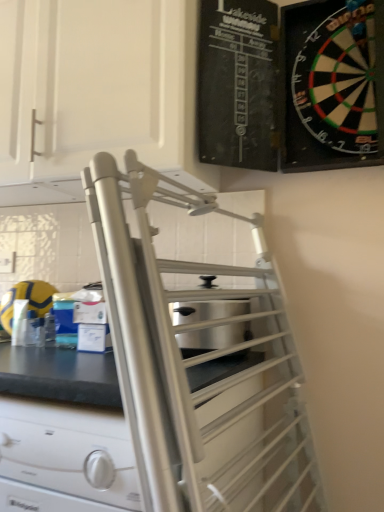
Describe the element at coordinates (96, 92) in the screenshot. I see `white matte cabinet at upper left, which is the 2th cabinetry from right to left` at that location.

The width and height of the screenshot is (384, 512). Describe the element at coordinates (332, 84) in the screenshot. I see `black plastic dartboard at upper right, the first cabinetry positioned from the right` at that location.

Describe the element at coordinates (213, 338) in the screenshot. I see `stainless steel toaster at center` at that location.

The width and height of the screenshot is (384, 512). I want to click on white matte cabinet at upper left, which is the 2th cabinetry from right to left, so click(96, 92).

From the image's perspective, which object appears higher, black plastic dartboard at upper right, the second cabinetry viewed from the left, or satin silver drawer at center?

From the image's view, black plastic dartboard at upper right, the second cabinetry viewed from the left, is above.

Which of these two, black plastic dartboard at upper right, the second cabinetry viewed from the left, or satin silver drawer at center, is bigger?

With larger size is satin silver drawer at center.

Can you confirm if black plastic dartboard at upper right, the second cabinetry viewed from the left, is shorter than satin silver drawer at center?

Correct, black plastic dartboard at upper right, the second cabinetry viewed from the left, is not as tall as satin silver drawer at center.

Considering the relative sizes of satin silver drawer at center and white matte cabinet at upper left, placed as the first cabinetry when sorted from left to right, in the image provided, is satin silver drawer at center smaller than white matte cabinet at upper left, placed as the first cabinetry when sorted from left to right,?

Indeed, satin silver drawer at center has a smaller size compared to white matte cabinet at upper left, placed as the first cabinetry when sorted from left to right.

From the image's perspective, who appears lower, satin silver drawer at center or white matte cabinet at upper left, placed as the first cabinetry when sorted from left to right?

satin silver drawer at center, from the image's perspective.

Looking at this image, considering the sizes of satin silver drawer at center and white matte cabinet at upper left, placed as the first cabinetry when sorted from left to right, in the image, is satin silver drawer at center taller or shorter than white matte cabinet at upper left, placed as the first cabinetry when sorted from left to right,?

Considering their sizes, satin silver drawer at center has less height than white matte cabinet at upper left, placed as the first cabinetry when sorted from left to right.

What's the angular difference between satin silver drawer at center and white matte cabinet at upper left, placed as the first cabinetry when sorted from left to right,'s facing directions?

They differ by 2.31 degrees in their facing directions.

Choose the correct answer: Is satin silver drawer at center inside black plastic dartboard at upper right, the first cabinetry positioned from the right, or outside it?

satin silver drawer at center exists outside the volume of black plastic dartboard at upper right, the first cabinetry positioned from the right.

In the scene shown: From the image's perspective, does satin silver drawer at center appear higher than black plastic dartboard at upper right, the first cabinetry positioned from the right?

No, from the image's perspective, satin silver drawer at center is not on top of black plastic dartboard at upper right, the first cabinetry positioned from the right.

Does satin silver drawer at center lie behind black plastic dartboard at upper right, the second cabinetry viewed from the left?

No, satin silver drawer at center is in front of black plastic dartboard at upper right, the second cabinetry viewed from the left.

Considering the sizes of satin silver drawer at center and black plastic dartboard at upper right, the second cabinetry viewed from the left, in the image, is satin silver drawer at center wider or thinner than black plastic dartboard at upper right, the second cabinetry viewed from the left,?

Considering their sizes, satin silver drawer at center looks broader than black plastic dartboard at upper right, the second cabinetry viewed from the left.

Would you say black plastic dartboard at upper right, the second cabinetry viewed from the left, is a long distance from white matte cabinet at upper left, placed as the first cabinetry when sorted from left to right?

No, black plastic dartboard at upper right, the second cabinetry viewed from the left, is not far away from white matte cabinet at upper left, placed as the first cabinetry when sorted from left to right.

Does black plastic dartboard at upper right, the second cabinetry viewed from the left, have a lesser width compared to white matte cabinet at upper left, placed as the first cabinetry when sorted from left to right?

Yes, black plastic dartboard at upper right, the second cabinetry viewed from the left, is thinner than white matte cabinet at upper left, placed as the first cabinetry when sorted from left to right.

Is white matte cabinet at upper left, placed as the first cabinetry when sorted from left to right, surrounded by black plastic dartboard at upper right, the first cabinetry positioned from the right?

No, black plastic dartboard at upper right, the first cabinetry positioned from the right, does not contain white matte cabinet at upper left, placed as the first cabinetry when sorted from left to right.

From a real-world perspective, is black plastic dartboard at upper right, the first cabinetry positioned from the right, over white matte cabinet at upper left, placed as the first cabinetry when sorted from left to right?

No, from a real-world perspective, black plastic dartboard at upper right, the first cabinetry positioned from the right, is not over white matte cabinet at upper left, placed as the first cabinetry when sorted from left to right

How many degrees apart are the facing directions of black plastic dartboard at upper right, the second cabinetry viewed from the left, and stainless steel toaster at center?

There is a 0.901-degree angle between the facing directions of black plastic dartboard at upper right, the second cabinetry viewed from the left, and stainless steel toaster at center.

Looking at the image, does black plastic dartboard at upper right, the second cabinetry viewed from the left, seem bigger or smaller compared to stainless steel toaster at center?

Considering their sizes, black plastic dartboard at upper right, the second cabinetry viewed from the left, takes up more space than stainless steel toaster at center.

Is stainless steel toaster at center located within black plastic dartboard at upper right, the first cabinetry positioned from the right?

No, stainless steel toaster at center is not inside black plastic dartboard at upper right, the first cabinetry positioned from the right.

Which of these two, stainless steel toaster at center or satin silver drawer at center, stands taller?

With more height is satin silver drawer at center.

Between stainless steel toaster at center and satin silver drawer at center, which one is positioned behind?

stainless steel toaster at center is further from the camera.

Are stainless steel toaster at center and satin silver drawer at center beside each other?

stainless steel toaster at center and satin silver drawer at center are not in contact.

Considering the positions of points (243, 313) and (15, 472), is point (243, 313) closer to camera compared to point (15, 472)?

No.

In terms of width, does stainless steel toaster at center look wider or thinner when compared to black plastic dartboard at upper right, the first cabinetry positioned from the right?

Clearly, stainless steel toaster at center has more width compared to black plastic dartboard at upper right, the first cabinetry positioned from the right.

Is stainless steel toaster at center positioned before black plastic dartboard at upper right, the first cabinetry positioned from the right?

That is False.

How much distance is there between stainless steel toaster at center and black plastic dartboard at upper right, the second cabinetry viewed from the left?

The distance of stainless steel toaster at center from black plastic dartboard at upper right, the second cabinetry viewed from the left, is 64.06 centimeters.

Where is `drawer below the black plastic dartboard at upper right, the second cabinetry viewed from the left (from the image's perspective)`? The height and width of the screenshot is (512, 384). drawer below the black plastic dartboard at upper right, the second cabinetry viewed from the left (from the image's perspective) is located at coordinates (65, 456).

Locate an element on the screen. cabinetry on the left of satin silver drawer at center is located at coordinates (96, 92).

Looking at the image, which one is located closer to satin silver drawer at center, white matte cabinet at upper left, which is the 2th cabinetry from right to left, or stainless steel toaster at center?

Based on the image, stainless steel toaster at center appears to be nearer to satin silver drawer at center.

When comparing their distances from black plastic dartboard at upper right, the first cabinetry positioned from the right, does white matte cabinet at upper left, placed as the first cabinetry when sorted from left to right, or stainless steel toaster at center seem closer?

white matte cabinet at upper left, placed as the first cabinetry when sorted from left to right, is positioned closer to the anchor black plastic dartboard at upper right, the first cabinetry positioned from the right.

Which object lies nearer to the anchor point black plastic dartboard at upper right, the first cabinetry positioned from the right, stainless steel toaster at center or white matte cabinet at upper left, placed as the first cabinetry when sorted from left to right?

white matte cabinet at upper left, placed as the first cabinetry when sorted from left to right, is closer to black plastic dartboard at upper right, the first cabinetry positioned from the right.

When comparing their distances from white matte cabinet at upper left, which is the 2th cabinetry from right to left, does stainless steel toaster at center or satin silver drawer at center seem closer?

stainless steel toaster at center lies closer to white matte cabinet at upper left, which is the 2th cabinetry from right to left, than the other object.

Looking at the image, which one is located closer to stainless steel toaster at center, black plastic dartboard at upper right, the first cabinetry positioned from the right, or satin silver drawer at center?

satin silver drawer at center is closer to stainless steel toaster at center.

Based on their spatial positions, is black plastic dartboard at upper right, the first cabinetry positioned from the right, or stainless steel toaster at center closer to satin silver drawer at center?

stainless steel toaster at center.

Looking at the image, which one is located further to black plastic dartboard at upper right, the second cabinetry viewed from the left, satin silver drawer at center or stainless steel toaster at center?

The object further to black plastic dartboard at upper right, the second cabinetry viewed from the left, is satin silver drawer at center.

Which object lies nearer to the anchor point satin silver drawer at center, stainless steel toaster at center or white matte cabinet at upper left, which is the 2th cabinetry from right to left?

Based on the image, stainless steel toaster at center appears to be nearer to satin silver drawer at center.

Image resolution: width=384 pixels, height=512 pixels. I want to click on cabinetry between white matte cabinet at upper left, placed as the first cabinetry when sorted from left to right, and satin silver drawer at center in the up-down direction, so click(x=332, y=84).

Where is `cabinetry between white matte cabinet at upper left, placed as the first cabinetry when sorted from left to right, and stainless steel toaster at center in the up-down direction`? cabinetry between white matte cabinet at upper left, placed as the first cabinetry when sorted from left to right, and stainless steel toaster at center in the up-down direction is located at coordinates (332, 84).

This screenshot has width=384, height=512. In order to click on appliance between black plastic dartboard at upper right, the first cabinetry positioned from the right, and satin silver drawer at center, in the vertical direction in this screenshot , I will do `click(213, 338)`.

This screenshot has height=512, width=384. I want to click on appliance between white matte cabinet at upper left, placed as the first cabinetry when sorted from left to right, and satin silver drawer at center from top to bottom, so click(x=213, y=338).